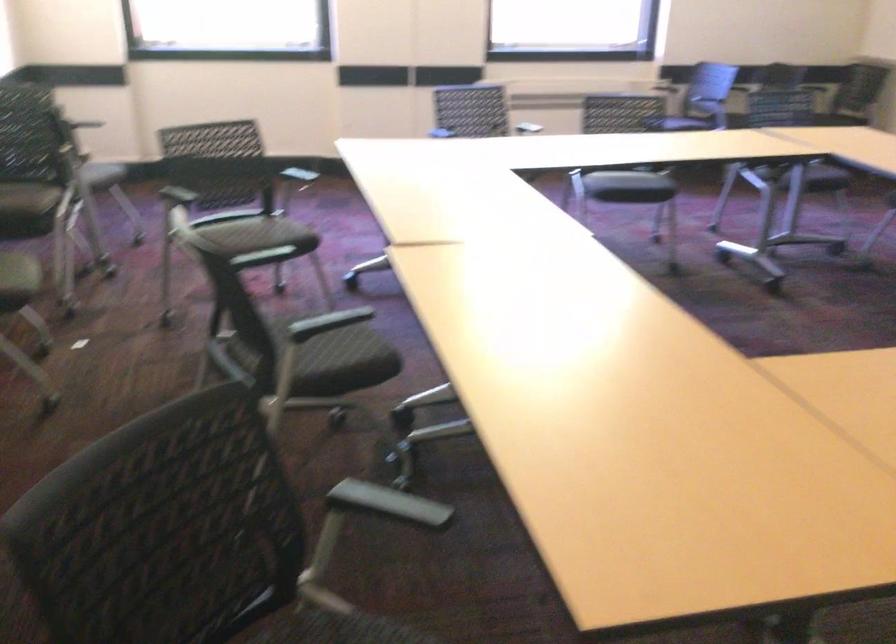
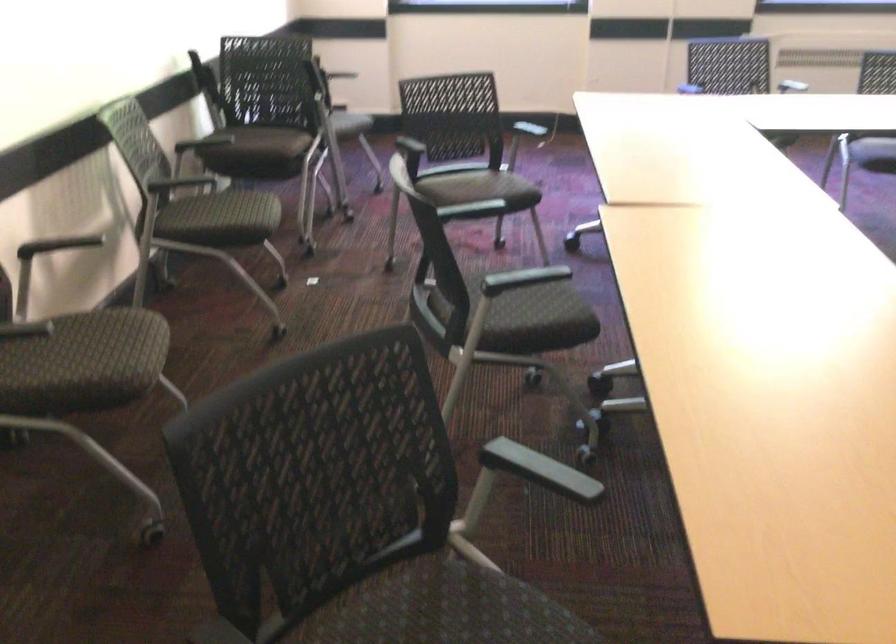
Find the pixel in the second image that matches the point at 336,362 in the first image.

(530, 319)